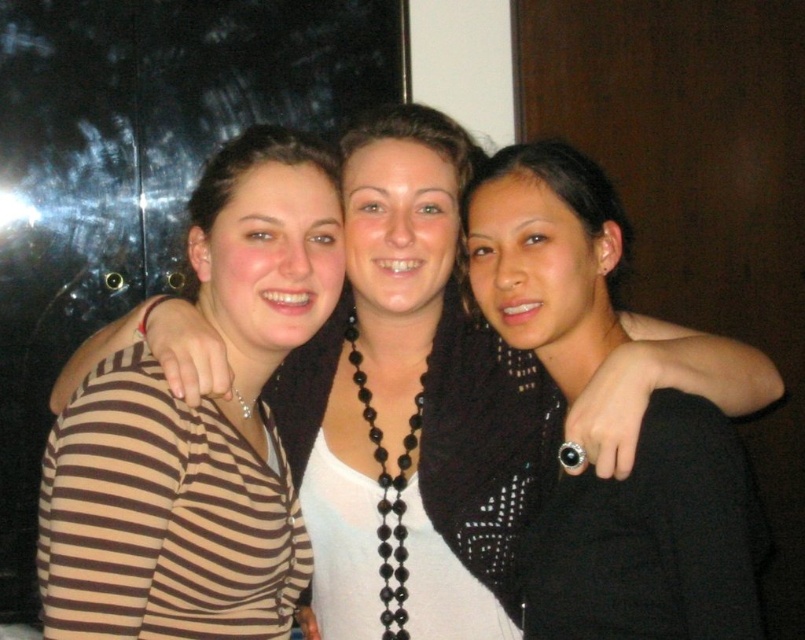
Does brown striped shirt at left have a lesser width compared to black beaded necklace at center?

In fact, brown striped shirt at left might be wider than black beaded necklace at center.

Can you confirm if brown striped shirt at left is smaller than black beaded necklace at center?

Incorrect, brown striped shirt at left is not smaller in size than black beaded necklace at center.

The width and height of the screenshot is (805, 640). Describe the element at coordinates (197, 428) in the screenshot. I see `brown striped shirt at left` at that location.

Where is `brown striped shirt at left`? The height and width of the screenshot is (640, 805). brown striped shirt at left is located at coordinates (197, 428).